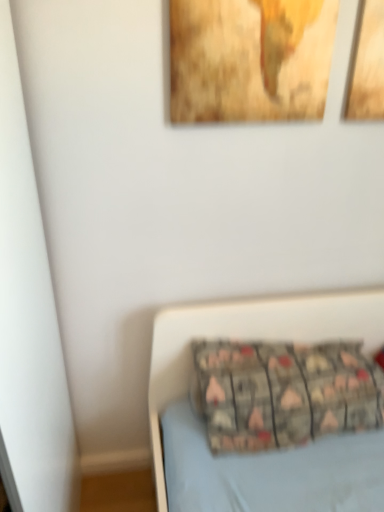
Image resolution: width=384 pixels, height=512 pixels. Describe the element at coordinates (283, 393) in the screenshot. I see `patterned fabric pillow at lower center` at that location.

Identify the location of patterned fabric pillow at lower center. (283, 393).

What are the coordinates of `wooden textured picture frame at upper center` in the screenshot? It's located at (249, 60).

Describe the element at coordinates (249, 60) in the screenshot. I see `wooden textured picture frame at upper center` at that location.

I want to click on patterned fabric pillow at lower center, so click(x=283, y=393).

Would you say wooden textured picture frame at upper center is to the left or to the right of patterned fabric pillow at lower center in the picture?

From the image, it's evident that wooden textured picture frame at upper center is to the left of patterned fabric pillow at lower center.

Considering their positions, is wooden textured picture frame at upper center located in front of or behind patterned fabric pillow at lower center?

wooden textured picture frame at upper center is in front of patterned fabric pillow at lower center.

Which is behind, point (202, 4) or point (328, 404)?

The point (328, 404) is farther from the camera.

From the image's perspective, who appears lower, wooden textured picture frame at upper center or patterned fabric pillow at lower center?

patterned fabric pillow at lower center is shown below in the image.

From a real-world perspective, is wooden textured picture frame at upper center positioned under patterned fabric pillow at lower center based on gravity?

No, from a real-world perspective, wooden textured picture frame at upper center is not beneath patterned fabric pillow at lower center.

Which of these two, wooden textured picture frame at upper center or patterned fabric pillow at lower center, is wider?

With larger width is patterned fabric pillow at lower center.

Which of these two, wooden textured picture frame at upper center or patterned fabric pillow at lower center, stands shorter?

Standing shorter between the two is patterned fabric pillow at lower center.

Based on the photo, considering the sizes of objects wooden textured picture frame at upper center and patterned fabric pillow at lower center in the image provided, who is bigger, wooden textured picture frame at upper center or patterned fabric pillow at lower center?

patterned fabric pillow at lower center is bigger.

Is patterned fabric pillow at lower center located within wooden textured picture frame at upper center?

No.

Are wooden textured picture frame at upper center and patterned fabric pillow at lower center making contact?

No, wooden textured picture frame at upper center is not next to patterned fabric pillow at lower center.

Consider the image. Is wooden textured picture frame at upper center positioned with its back to patterned fabric pillow at lower center?

No, wooden textured picture frame at upper center's orientation is not away from patterned fabric pillow at lower center.

The image size is (384, 512). I want to click on picture frame above the patterned fabric pillow at lower center (from a real-world perspective), so click(249, 60).

Is patterned fabric pillow at lower center to the left or to the right of wooden textured picture frame at upper center in the image?

From the image, it's evident that patterned fabric pillow at lower center is to the right of wooden textured picture frame at upper center.

Consider the image. Which is in front, patterned fabric pillow at lower center or wooden textured picture frame at upper center?

wooden textured picture frame at upper center is in front.

Does point (204, 355) come closer to viewer compared to point (259, 46)?

No, (204, 355) is further to viewer.

From the image's perspective, does patterned fabric pillow at lower center appear lower than wooden textured picture frame at upper center?

Yes, from the image's perspective, patterned fabric pillow at lower center is below wooden textured picture frame at upper center.

From a real-world perspective, which object rests below the other?

patterned fabric pillow at lower center.

In terms of width, does patterned fabric pillow at lower center look wider or thinner when compared to wooden textured picture frame at upper center?

In the image, patterned fabric pillow at lower center appears to be wider than wooden textured picture frame at upper center.

Considering the sizes of objects patterned fabric pillow at lower center and wooden textured picture frame at upper center in the image provided, who is taller, patterned fabric pillow at lower center or wooden textured picture frame at upper center?

Standing taller between the two is wooden textured picture frame at upper center.

Considering the sizes of objects patterned fabric pillow at lower center and wooden textured picture frame at upper center in the image provided, who is smaller, patterned fabric pillow at lower center or wooden textured picture frame at upper center?

With smaller size is wooden textured picture frame at upper center.

Is patterned fabric pillow at lower center spatially inside wooden textured picture frame at upper center, or outside of it?

patterned fabric pillow at lower center is not inside wooden textured picture frame at upper center, it's outside.

Is there a large distance between patterned fabric pillow at lower center and wooden textured picture frame at upper center?

That's not correct — patterned fabric pillow at lower center is a little close to wooden textured picture frame at upper center.

Is patterned fabric pillow at lower center positioned with its back to wooden textured picture frame at upper center?

No, patterned fabric pillow at lower center is not facing away from wooden textured picture frame at upper center.

Consider the image. How different are the orientations of patterned fabric pillow at lower center and wooden textured picture frame at upper center in degrees?

The facing directions of patterned fabric pillow at lower center and wooden textured picture frame at upper center are 1.14 degrees apart.

In order to click on picture frame above the patterned fabric pillow at lower center (from a real-world perspective) in this screenshot , I will do `click(249, 60)`.

Where is `pillow that is on the right side of wooden textured picture frame at upper center`? Image resolution: width=384 pixels, height=512 pixels. pillow that is on the right side of wooden textured picture frame at upper center is located at coordinates (283, 393).

Find the location of a particular element. Image resolution: width=384 pixels, height=512 pixels. picture frame on the left of patterned fabric pillow at lower center is located at coordinates (249, 60).